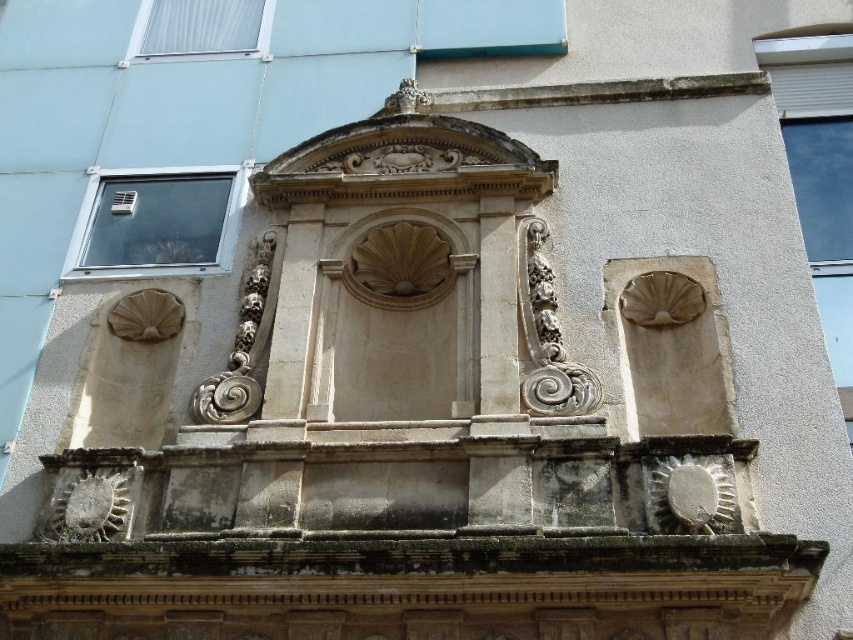
Question: Can you confirm if transparent glass window at upper left is smaller than white plastic window at upper left?

Choices:
 (A) yes
 (B) no

Answer: (A)

Question: Which of the following is the closest to the observer?

Choices:
 (A) transparent glass window at upper left
 (B) white plastic window at upper left

Answer: (A)

Question: Can you confirm if transparent glass window at upper left is positioned to the left of white plastic window at upper left?

Choices:
 (A) no
 (B) yes

Answer: (A)

Question: Which point is farther from the camera taking this photo?

Choices:
 (A) (173, 28)
 (B) (114, 182)

Answer: (A)

Question: Does transparent glass window at upper left appear on the left side of white plastic window at upper left?

Choices:
 (A) no
 (B) yes

Answer: (A)